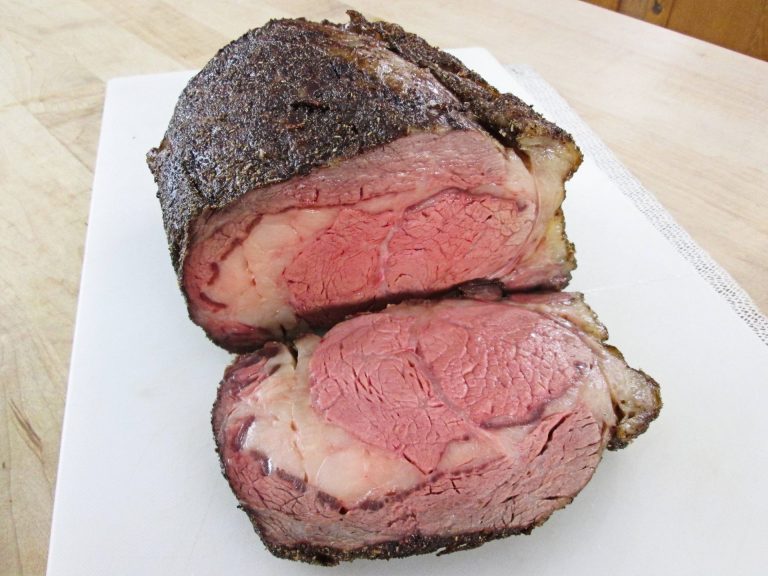
The height and width of the screenshot is (576, 768). I want to click on white cutting board, so click(164, 442).